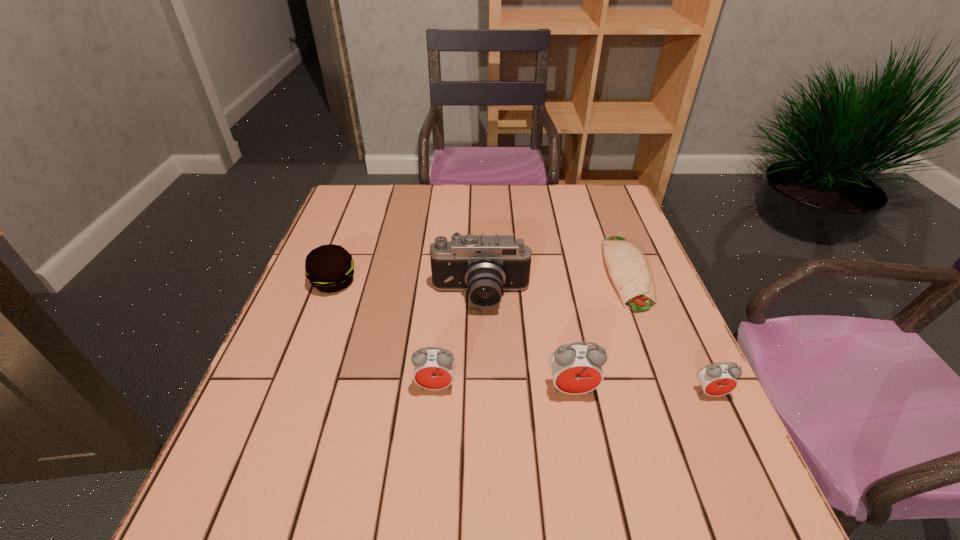
The height and width of the screenshot is (540, 960). Identify the location of vacant space at the far left corner of the desktop. (361, 186).

This screenshot has height=540, width=960. I want to click on blank space at the near left corner, so click(x=263, y=453).

In the image, there is a desktop. Where is `vacant region at the far right corner`? This screenshot has width=960, height=540. vacant region at the far right corner is located at coordinates (586, 226).

The height and width of the screenshot is (540, 960). I want to click on free space at the near right corner of the desktop, so click(692, 462).

This screenshot has height=540, width=960. I want to click on free space between the patty and the camera, so click(x=407, y=289).

The image size is (960, 540). What are the coordinates of `vacant space in between the shortest object and the rightmost alarm clock` in the screenshot? It's located at (668, 333).

This screenshot has height=540, width=960. In order to click on free spot between the patty and the shortest alarm clock in this screenshot , I will do `click(522, 338)`.

What are the coordinates of `vacant space that's between the second alarm clock from right to left and the leftmost object` in the screenshot? It's located at (453, 336).

This screenshot has width=960, height=540. What are the coordinates of `free space between the burrito and the camera` in the screenshot? It's located at (554, 285).

Find the location of a particular element. The width and height of the screenshot is (960, 540). empty space between the shortest alarm clock and the shortest object is located at coordinates (668, 333).